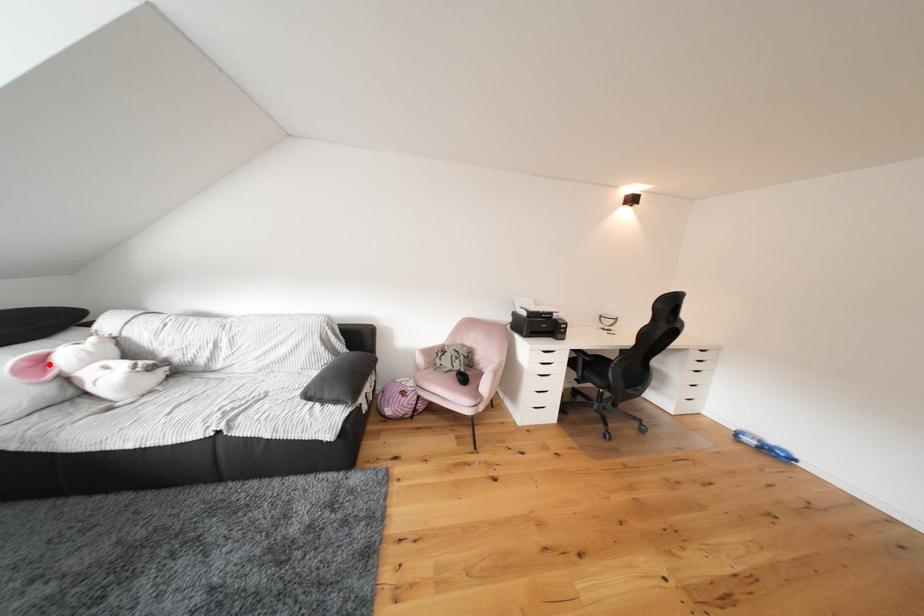
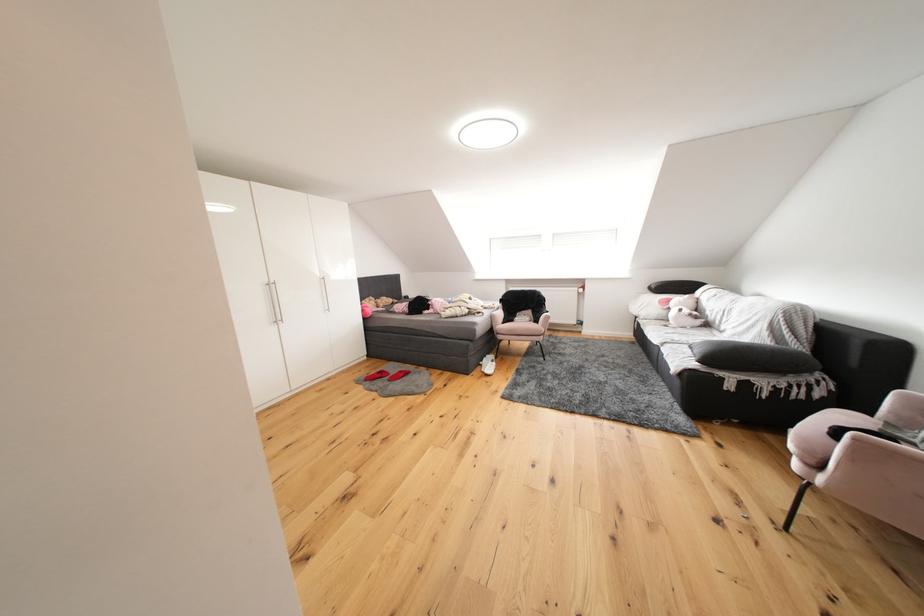
Where in the second image is the point corresponding to the highlighted location from the first image?

(677, 305)